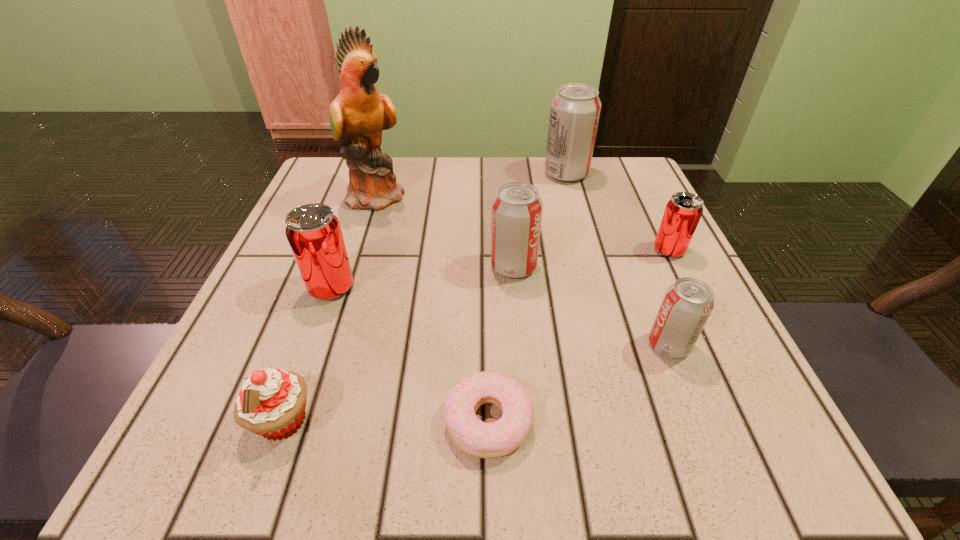
The image size is (960, 540). Find the location of `vacant position located 0.330m on the back of the nearest gray soda can`. vacant position located 0.330m on the back of the nearest gray soda can is located at coordinates (615, 210).

I want to click on vacant space located 0.140m on the back of the cupcake, so click(x=320, y=316).

Image resolution: width=960 pixels, height=540 pixels. Find the location of `vacant space situated 0.190m on the right of the shortest object`. vacant space situated 0.190m on the right of the shortest object is located at coordinates (677, 420).

Locate an element on the screen. Image resolution: width=960 pixels, height=540 pixels. parrot that is positioned at the far edge is located at coordinates (358, 115).

In order to click on soda can that is at the far edge in this screenshot , I will do `click(575, 109)`.

Image resolution: width=960 pixels, height=540 pixels. Find the location of `cupcake at the near edge`. cupcake at the near edge is located at coordinates (272, 402).

Identify the location of doughnut that is positioned at the near edge. This screenshot has height=540, width=960. (474, 437).

The height and width of the screenshot is (540, 960). I want to click on parrot located at the left edge, so click(358, 115).

The image size is (960, 540). I want to click on soda can positioned at the left edge, so click(x=314, y=233).

Find the location of a particular element. The width and height of the screenshot is (960, 540). cupcake at the left edge is located at coordinates (272, 402).